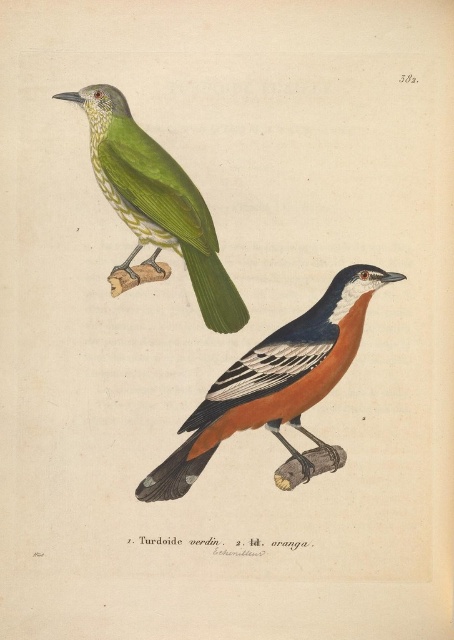
You are standing at the point labeled as point (279, 406) in a coordinate system where the origin is at the bottom left corner of the image. If you want to move forward 4.44 feet towards the direction facing away from the viewer, will you collide with any object in the scene?

Since the point labeled as point (279, 406) is 4.44 feet away from the viewer, moving forward 4.44 feet in the direction away from the viewer would place you exactly at that point. However, the scene description does not mention any objects at that specific location, so there should be no collision with any object in the scene.

You are an ornithologist examining the illustration. The orange matte bird at center and the green speckled feathers at upper left are both perched on branches. Which bird is closer to the bottom of the page?

The orange matte bird at center is closer to the bottom of the page because it is shorter than the green speckled feathers at upper left.